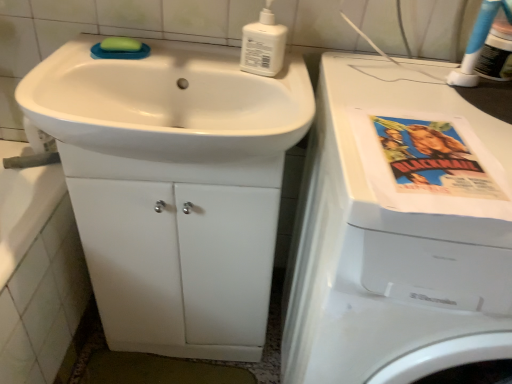
This screenshot has width=512, height=384. Describe the element at coordinates (168, 102) in the screenshot. I see `white glossy sink at center` at that location.

Image resolution: width=512 pixels, height=384 pixels. What do you see at coordinates (120, 45) in the screenshot? I see `green matte soap at upper left` at bounding box center [120, 45].

Find the location of `white plastic bottle at upper center`. white plastic bottle at upper center is located at coordinates (263, 45).

Is white plastic washing machine at right at the back of white plastic bottle at upper center?

That's not correct — white plastic bottle at upper center is not looking away from white plastic washing machine at right.

Which is more to the right, white plastic bottle at upper center or white plastic washing machine at right?

white plastic washing machine at right is more to the right.

Which object is more forward, white plastic bottle at upper center or white plastic washing machine at right?

white plastic washing machine at right is more forward.

Relative to white plastic bottle at upper center, is green matte soap at upper left in front or behind?

Visually, green matte soap at upper left is located behind white plastic bottle at upper center.

From a real-world perspective, between green matte soap at upper left and white plastic bottle at upper center, who is vertically lower?

green matte soap at upper left, from a real-world perspective.

How many degrees apart are the facing directions of green matte soap at upper left and white plastic bottle at upper center?

6.25 degrees separate the facing orientations of green matte soap at upper left and white plastic bottle at upper center.

Is white plastic washing machine at right facing away from white glossy sink at center?

No, white plastic washing machine at right's orientation is not away from white glossy sink at center.

Consider the image. Considering the relative sizes of white plastic washing machine at right and white glossy sink at center in the image provided, is white plastic washing machine at right thinner than white glossy sink at center?

In fact, white plastic washing machine at right might be wider than white glossy sink at center.

Considering the sizes of objects white glossy sink at center and white plastic bottle at upper center in the image provided, who is taller, white glossy sink at center or white plastic bottle at upper center?

Standing taller between the two is white plastic bottle at upper center.

In the image, is white glossy sink at center on the left side or the right side of white plastic bottle at upper center?

Based on their positions, white glossy sink at center is located to the left of white plastic bottle at upper center.

Which point is more distant from viewer, (300, 76) or (251, 63)?

The point (300, 76) is behind.

From a real-world perspective, who is located lower, white glossy sink at center or white plastic bottle at upper center?

In real-world perspective, white glossy sink at center is lower.

Is white glossy sink at center not inside white plastic washing machine at right?

Absolutely, white glossy sink at center is external to white plastic washing machine at right.

From a real-world perspective, who is located higher, white glossy sink at center or white plastic washing machine at right?

white glossy sink at center is physically above.

The width and height of the screenshot is (512, 384). I want to click on washing machine in front of the white glossy sink at center, so click(x=389, y=249).

How different are the orientations of white glossy sink at center and white plastic washing machine at right in degrees?

white glossy sink at center and white plastic washing machine at right are facing 0.347 degrees away from each other.

Is white glossy cabinet at center a part of green matte soap at upper left?

No, green matte soap at upper left does not contain white glossy cabinet at center.

Is green matte soap at upper left far from white glossy cabinet at center?

green matte soap at upper left is near white glossy cabinet at center, not far away.

From a real-world perspective, between green matte soap at upper left and white glossy cabinet at center, who is vertically higher?

green matte soap at upper left.

Does white plastic bottle at upper center have a lesser height compared to green matte soap at upper left?

No, white plastic bottle at upper center is not shorter than green matte soap at upper left.

In terms of width, does white plastic bottle at upper center look wider or thinner when compared to green matte soap at upper left?

Clearly, white plastic bottle at upper center has more width compared to green matte soap at upper left.

Is white plastic bottle at upper center oriented towards green matte soap at upper left?

No, white plastic bottle at upper center is not aimed at green matte soap at upper left.

From the image's perspective, is white plastic bottle at upper center under green matte soap at upper left?

No, from the image's perspective, white plastic bottle at upper center is not below green matte soap at upper left.

Find the location of `soap dispenser behind the white plastic washing machine at right`. soap dispenser behind the white plastic washing machine at right is located at coordinates (263, 45).

What are the coordinates of `soap below the white plastic bottle at upper center (from the image's perspective)` in the screenshot? It's located at (120, 45).

Considering their positions, is white glossy cabinet at center positioned further to green matte soap at upper left than white plastic bottle at upper center?

white glossy cabinet at center.

Estimate the real-world distances between objects in this image. Which object is further from white glossy sink at center, white plastic bottle at upper center or white plastic washing machine at right?

white plastic washing machine at right is further to white glossy sink at center.

Which object lies further to the anchor point white glossy cabinet at center, white glossy sink at center or green matte soap at upper left?

green matte soap at upper left lies further to white glossy cabinet at center than the other object.

Which object lies further to the anchor point white glossy sink at center, white plastic washing machine at right or green matte soap at upper left?

white plastic washing machine at right is further to white glossy sink at center.

Looking at this image, which object lies further to the anchor point white glossy sink at center, white plastic bottle at upper center or green matte soap at upper left?

green matte soap at upper left lies further to white glossy sink at center than the other object.

Estimate the real-world distances between objects in this image. Which object is further from white glossy cabinet at center, green matte soap at upper left or white plastic bottle at upper center?

Among the two, green matte soap at upper left is located further to white glossy cabinet at center.

Looking at the image, which one is located further to white plastic bottle at upper center, white glossy cabinet at center or green matte soap at upper left?

The object further to white plastic bottle at upper center is white glossy cabinet at center.

Looking at the image, which one is located closer to white plastic bottle at upper center, white glossy sink at center or white glossy cabinet at center?

Among the two, white glossy sink at center is located nearer to white plastic bottle at upper center.

Where is `drawer situated between green matte soap at upper left and white plastic washing machine at right from left to right`? Image resolution: width=512 pixels, height=384 pixels. drawer situated between green matte soap at upper left and white plastic washing machine at right from left to right is located at coordinates (179, 264).

This screenshot has width=512, height=384. Identify the location of sink between white plastic bottle at upper center and white plastic washing machine at right in the vertical direction. (168, 102).

The width and height of the screenshot is (512, 384). I want to click on sink between green matte soap at upper left and white plastic washing machine at right in the horizontal direction, so click(x=168, y=102).

At what (x,y) coordinates should I click in order to perform the action: click on soap that lies between white plastic bottle at upper center and white glossy cabinet at center from top to bottom. Please return your answer as a coordinate pair (x, y). This screenshot has width=512, height=384. Looking at the image, I should click on (120, 45).